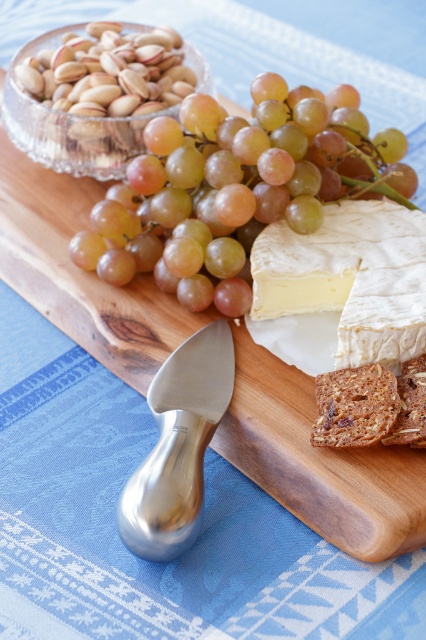
Is point (305, 205) less distant than point (69, 164)?

Yes.

Is green matte grape at center closer to camera compared to translucent glass bowl at upper left?

Yes, green matte grape at center is in front of translucent glass bowl at upper left.

At what (x,y) coordinates should I click in order to perform the action: click on green matte grape at center. Please return your answer as a coordinate pair (x, y). The height and width of the screenshot is (640, 426). Looking at the image, I should click on (235, 188).

I want to click on green matte grape at center, so click(235, 188).

Between white creamy cheese at center and translucent glass bowl at upper left, which one is positioned higher?

translucent glass bowl at upper left

Does white creamy cheese at center come behind translucent glass bowl at upper left?

No, white creamy cheese at center is closer to the viewer.

Is point (307, 280) positioned before point (37, 156)?

Yes, point (307, 280) is in front of point (37, 156).

The width and height of the screenshot is (426, 640). Find the location of `white creamy cheese at center`. white creamy cheese at center is located at coordinates (342, 288).

Is green matte grape at center shorter than white creamy cheese at center?

Incorrect, green matte grape at center's height does not fall short of white creamy cheese at center's.

Locate an element on the screen. The image size is (426, 640). green matte grape at center is located at coordinates (235, 188).

In order to click on green matte grape at center in this screenshot , I will do `click(235, 188)`.